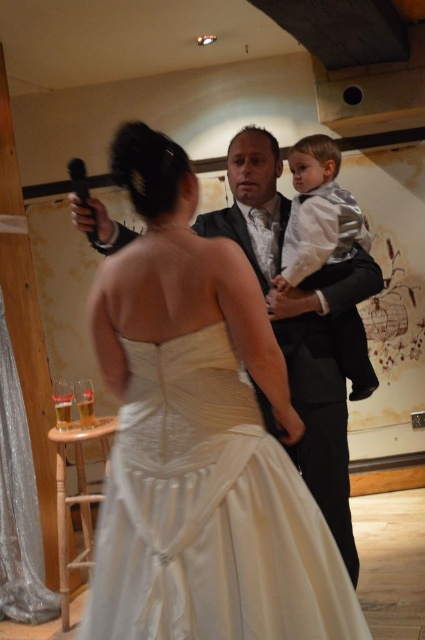
Who is positioned more to the right, satin dress at center or silver shiny suit at center?

silver shiny suit at center

Is point (300, 611) positioned before point (357, 388)?

Yes.

This screenshot has width=425, height=640. Describe the element at coordinates (209, 513) in the screenshot. I see `satin dress at center` at that location.

Image resolution: width=425 pixels, height=640 pixels. Find the location of `satin dress at center`. satin dress at center is located at coordinates (209, 513).